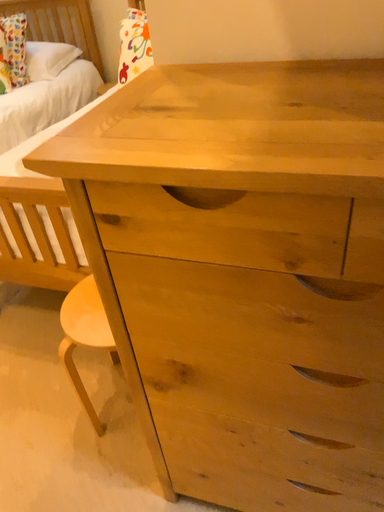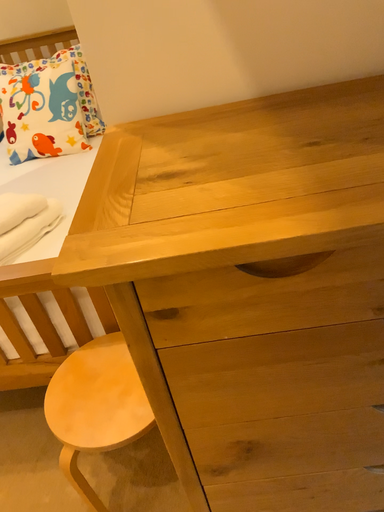
Question: Which way did the camera rotate in the video?

Choices:
 (A) rotated right
 (B) rotated left

Answer: (A)